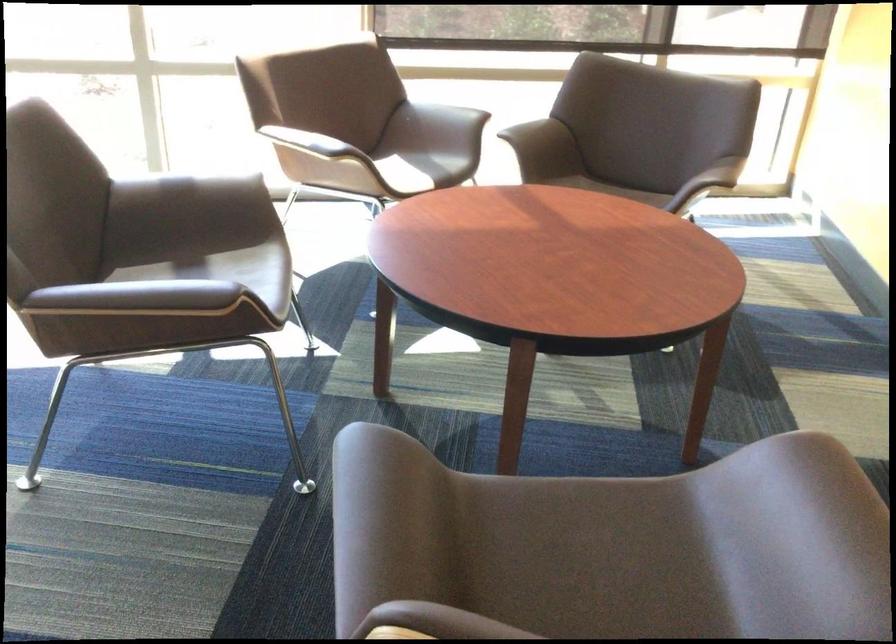
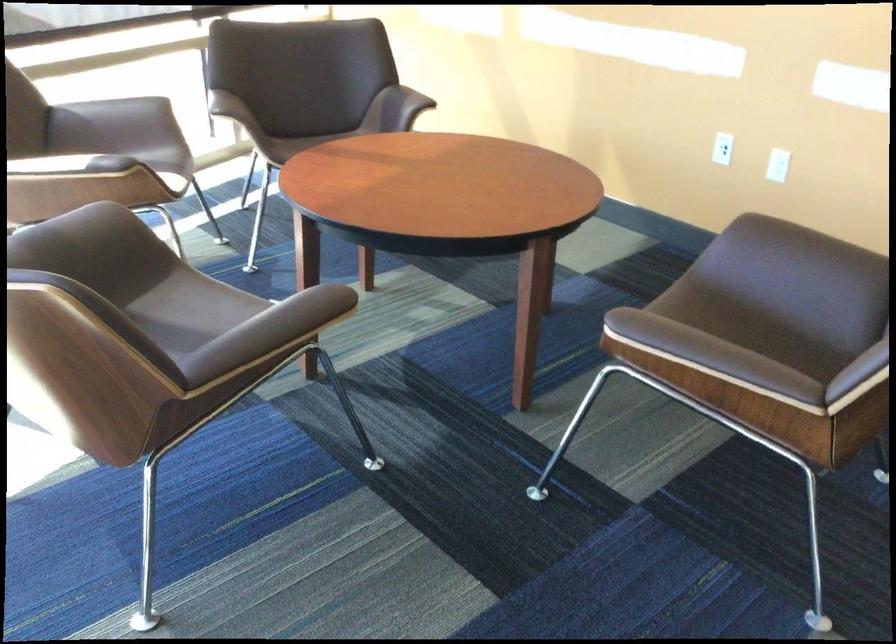
The point at (815, 526) is marked in the first image. Where is the corresponding point in the second image?

(802, 251)